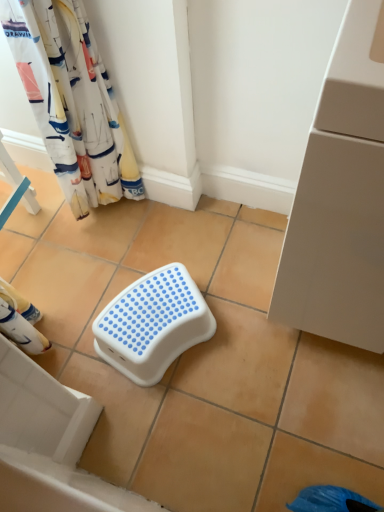
At what (x,y) coordinates should I click in order to perform the action: click on vacant space that's between white fabric curtain at upper left and white plastic step stool at center. Please return your answer as a coordinate pair (x, y). Looking at the image, I should click on (138, 248).